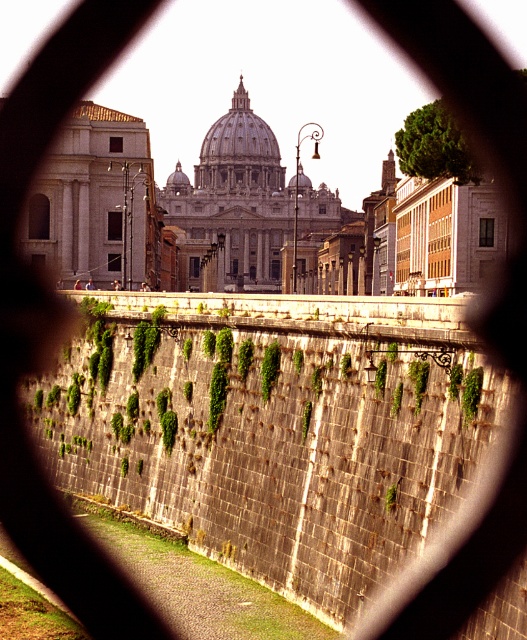
Question: Is green mossy stone wall at center closer to the viewer compared to white marble dome at center?

Choices:
 (A) yes
 (B) no

Answer: (A)

Question: Which object appears farthest from the camera in this image?

Choices:
 (A) green mossy stone wall at center
 (B) marble dome at center
 (C) white marble dome at center

Answer: (B)

Question: Which object is positioned closest to the white marble dome at center?

Choices:
 (A) marble dome at center
 (B) green mossy stone wall at center

Answer: (A)

Question: Can you confirm if green mossy stone wall at center is bigger than white marble dome at center?

Choices:
 (A) no
 (B) yes

Answer: (A)

Question: Which point is farther to the camera?

Choices:
 (A) (239, 120)
 (B) (240, 140)
 (C) (510, 634)

Answer: (A)

Question: Observing the image, what is the correct spatial positioning of white marble dome at center in reference to marble dome at center?

Choices:
 (A) left
 (B) right

Answer: (B)